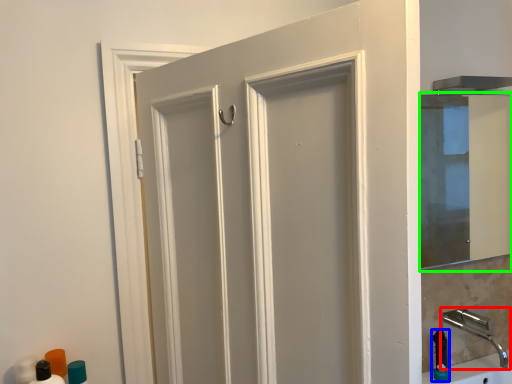
Question: Which is farther away from tap (highlighted by a red box)? soap dispenser (highlighted by a blue box) or mirror (highlighted by a green box)?

Choices:
 (A) soap dispenser
 (B) mirror

Answer: (B)